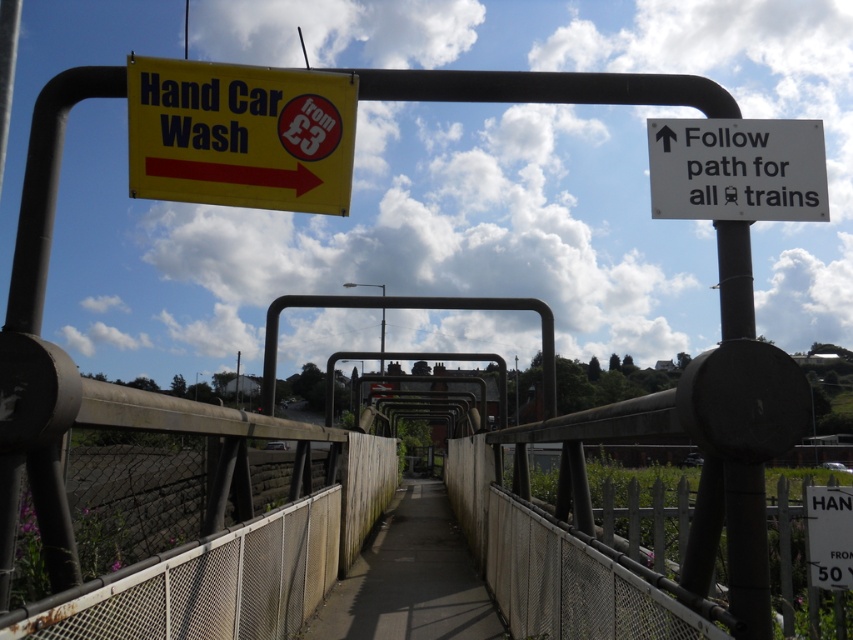
You are a delivery person carrying a large package that is 1.5 meters wide. You need to walk along the concrete sidewalk at center while avoiding the black metal pole at center. Is there enough space for you to pass safely?

The concrete sidewalk at center has a larger size compared to black metal pole at center, so there should be enough space for the delivery person to pass safely while avoiding the pole.

You are a pedestrian standing on the concrete sidewalk at center and looking towards the white plastic sign at upper right. Which object is closer to your current position?

The concrete sidewalk at center is closer to your current position since it is positioned on the left side of the white plastic sign at upper right, meaning it is nearer to you.

You are a pedestrian walking on the concrete sidewalk at center and want to read the yellow plastic sign at upper left. Is the sign positioned in a way that you can easily see it while walking?

The yellow plastic sign at upper left is above the concrete sidewalk at center, so yes, the sign is positioned above the sidewalk, making it easily visible to pedestrians walking below.